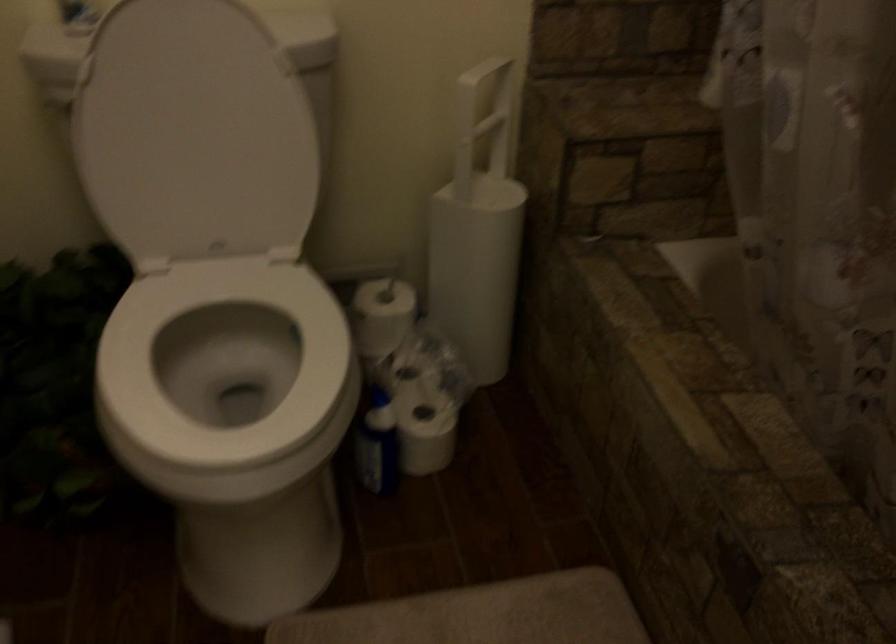
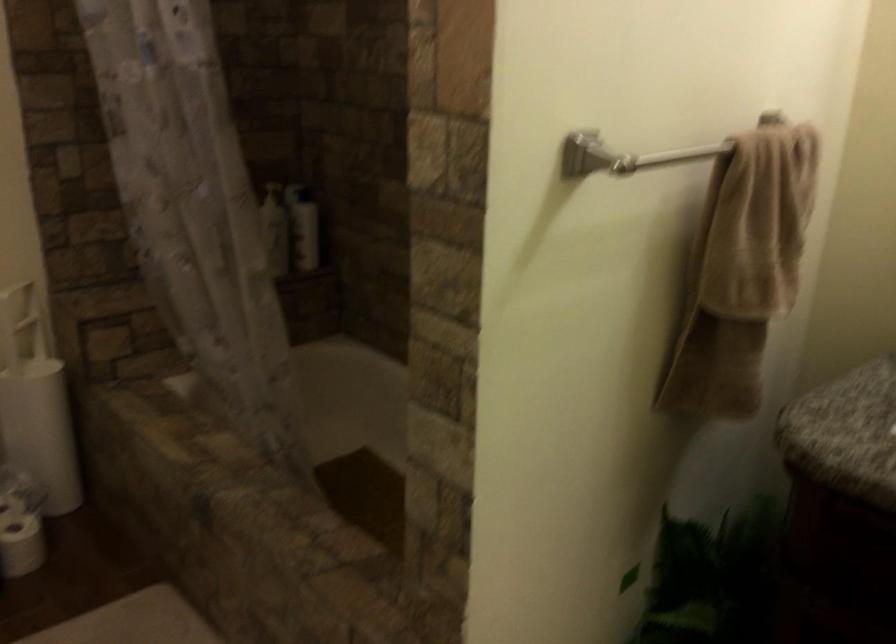
Where in the second image is the point corresponding to (426,415) from the first image?

(20, 524)